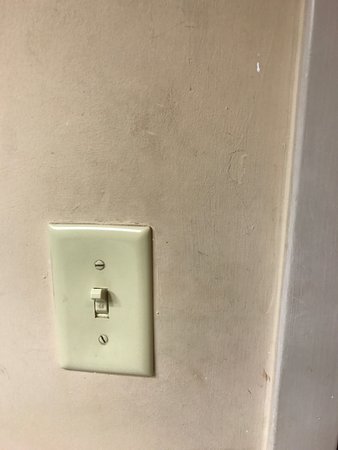
In order to click on wall in this screenshot , I will do `click(222, 347)`.